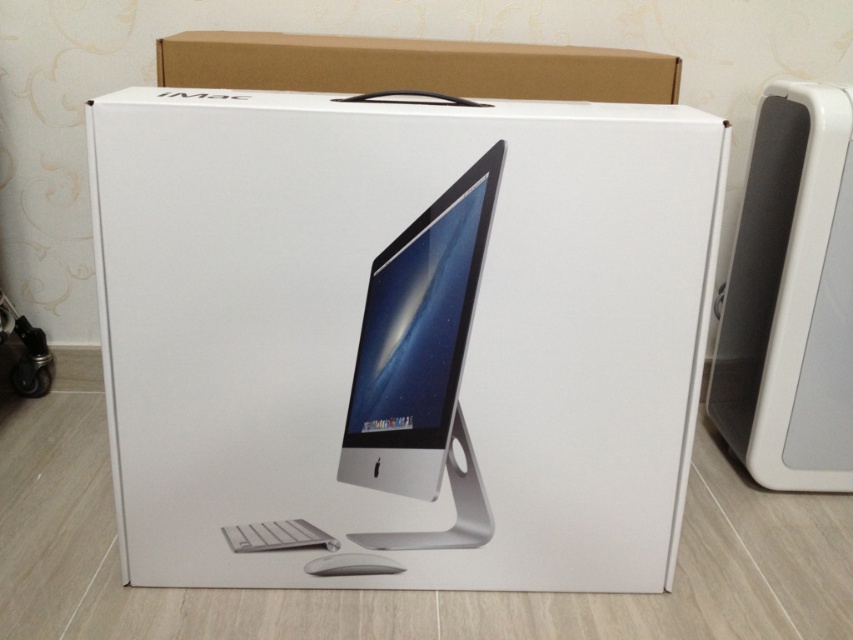
You are looking at the iMac box and want to place a sticker on the box. You have two points to choose from. The first point is at coordinate point (802, 420) and the second is at coordinate point (334, 557). Which point is closer to you?

Point (802, 420) is closer to you than point (334, 557) because it is further to the viewer according to the description.

You are setting up your new iMac and need to place the white plastic speaker at right and the white matte mouse at lower center on your desk. Which object requires more vertical space due to its height?

The white plastic speaker at right requires more vertical space because it is taller than the white matte mouse at lower center.